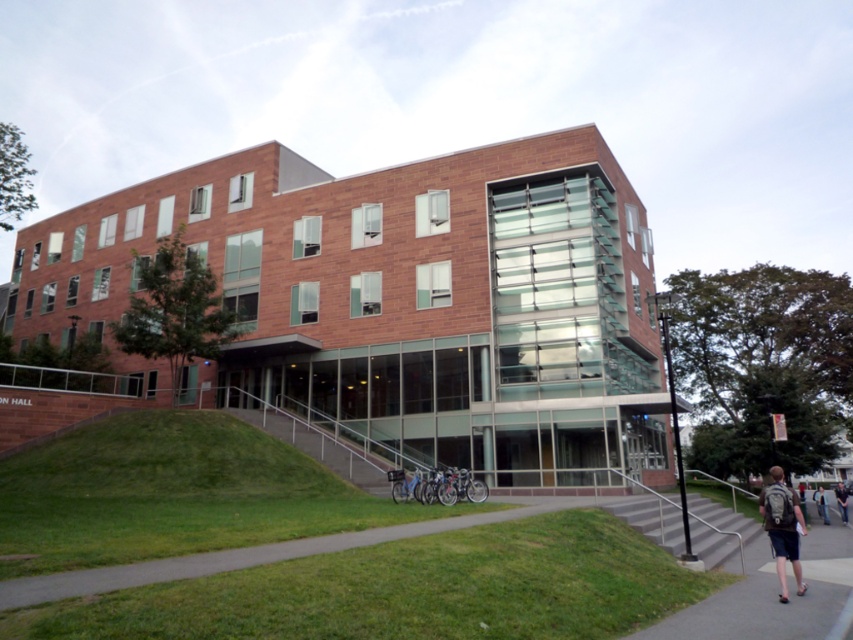
Which is more to the left, metallic gray staircase at lower right or light blue jeans at lower right?

metallic gray staircase at lower right

Between metallic gray staircase at lower right and light blue jeans at lower right, which one is positioned lower?

light blue jeans at lower right

This screenshot has height=640, width=853. What do you see at coordinates (717, 529) in the screenshot?
I see `metallic gray staircase at lower right` at bounding box center [717, 529].

You are a GUI agent. You are given a task and a screenshot of the screen. Output one action in this format:
    pyautogui.click(x=<x>, y=<y>)
    Task: Click on the metallic gray staircase at lower right
    This screenshot has width=853, height=640.
    Given the screenshot: What is the action you would take?
    pyautogui.click(x=717, y=529)

Can you confirm if metallic gray staircase at lower right is taller than gray backpack at lower right?

No, metallic gray staircase at lower right is not taller than gray backpack at lower right.

Does metallic gray staircase at lower right appear on the right side of gray backpack at lower right?

No, metallic gray staircase at lower right is not to the right of gray backpack at lower right.

Locate an element on the screen. The height and width of the screenshot is (640, 853). metallic gray staircase at lower right is located at coordinates (717, 529).

Can you confirm if light blue jeans at lower right is positioned below dark blue jeans at lower right?

Indeed, light blue jeans at lower right is positioned under dark blue jeans at lower right.

Between light blue jeans at lower right and dark blue jeans at lower right, which one has more height?

With more height is light blue jeans at lower right.

Is point (822, 493) positioned behind point (846, 492)?

No, it is not.

Image resolution: width=853 pixels, height=640 pixels. I want to click on light blue jeans at lower right, so click(x=820, y=502).